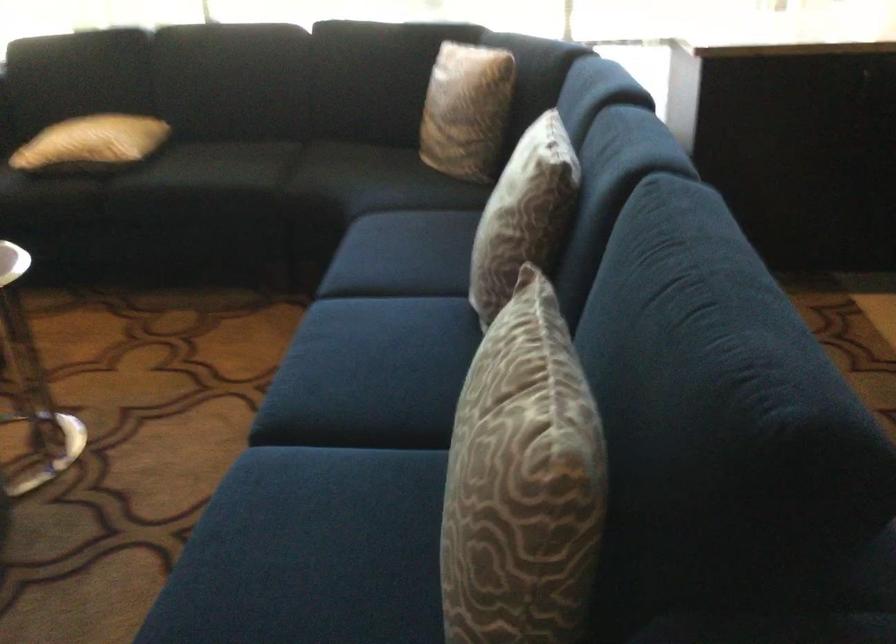
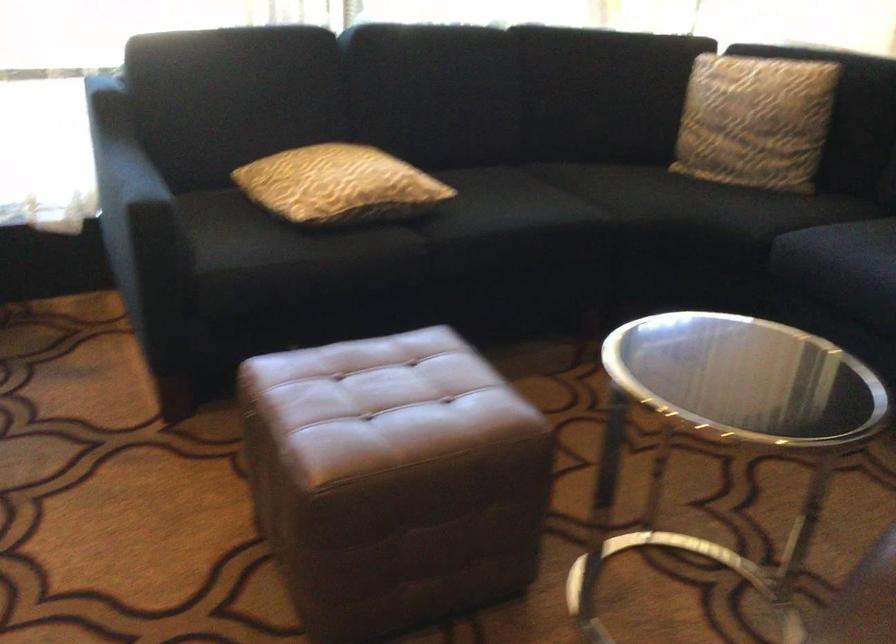
Question: I am providing you with two images of the same scene from different viewpoints. Which of the following objects are not visible in image2?

Choices:
 (A) yellow patterned pillow
 (B) brown leather ottoman
 (C) sofa sitting surface
 (D) none of these

Answer: (D)